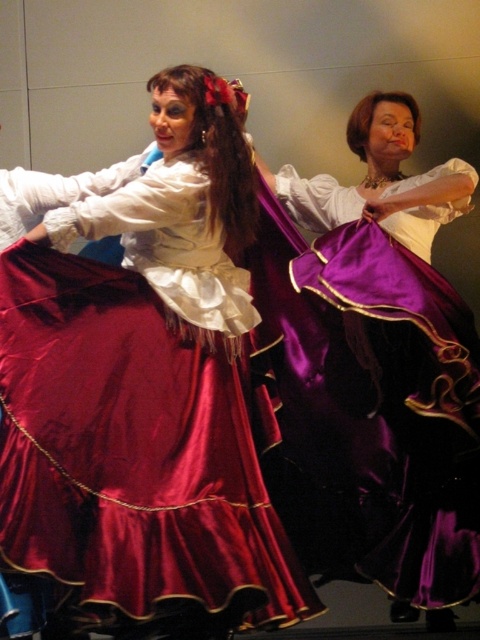
Question: Among these points, which one is farthest from the camera?

Choices:
 (A) (474, 497)
 (B) (266, 624)

Answer: (A)

Question: Can you confirm if satin dress at center is wider than satin purple dress at center?

Choices:
 (A) no
 (B) yes

Answer: (B)

Question: Is satin dress at center above satin purple dress at center?

Choices:
 (A) yes
 (B) no

Answer: (A)

Question: Among these points, which one is farthest from the camera?

Choices:
 (A) (72, 618)
 (B) (379, 300)

Answer: (B)

Question: Which point is farther from the camera taking this photo?

Choices:
 (A) (359, 353)
 (B) (60, 292)

Answer: (A)

Question: Does satin dress at center appear over satin purple dress at center?

Choices:
 (A) no
 (B) yes

Answer: (B)